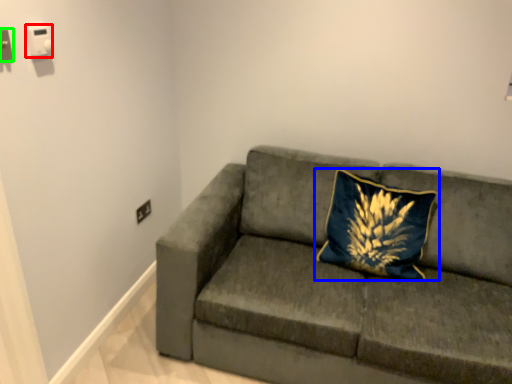
Question: Estimate the real-world distances between objects in this image. Which object is closer to electric outlet (highlighted by a red box), pillow (highlighted by a blue box) or electric outlet (highlighted by a green box)?

Choices:
 (A) pillow
 (B) electric outlet

Answer: (B)